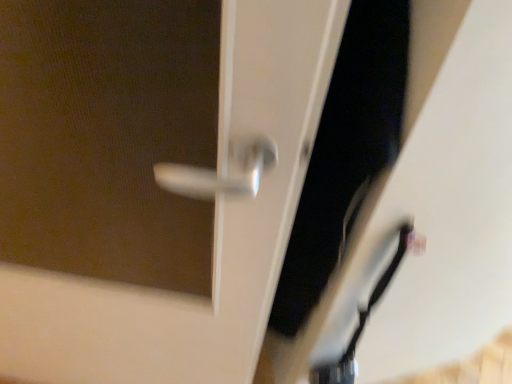
What is the approximate width of satin silver handle at center?

satin silver handle at center is 8.60 inches wide.

Where is `satin silver handle at center`? Image resolution: width=512 pixels, height=384 pixels. satin silver handle at center is located at coordinates (277, 150).

Image resolution: width=512 pixels, height=384 pixels. Describe the element at coordinates (277, 150) in the screenshot. I see `satin silver handle at center` at that location.

Identify the location of satin silver handle at center. (277, 150).